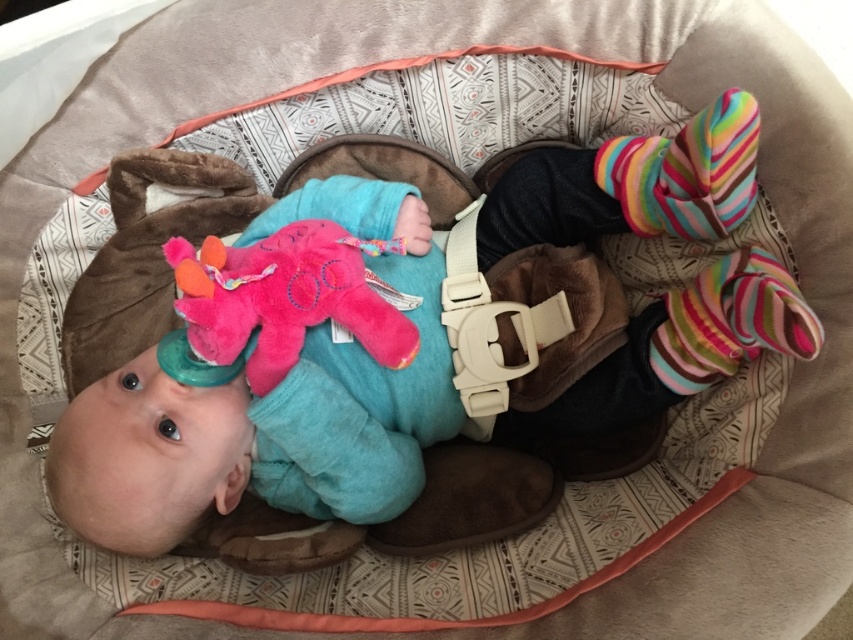
Which is more to the right, multicolored fuzzy socks at upper right or multicolored striped sock at right?

→ multicolored striped sock at right is more to the right.

Is multicolored fuzzy socks at upper right to the right of multicolored striped sock at right from the viewer's perspective?

No, multicolored fuzzy socks at upper right is not to the right of multicolored striped sock at right.

Who is more distant from viewer, (653, 180) or (786, 332)?

The point (653, 180) is more distant.

Identify the location of multicolored fuzzy socks at upper right. (686, 172).

Is pink plush toy at center below multicolored striped sock at right?

Actually, pink plush toy at center is above multicolored striped sock at right.

In the scene shown: Is pink plush toy at center bigger than multicolored striped sock at right?

Yes, pink plush toy at center is bigger than multicolored striped sock at right.

Does point (238, 252) come farther from viewer compared to point (750, 316)?

Yes, it is.

Locate an element on the screen. pink plush toy at center is located at coordinates (281, 301).

Is point (216, 310) farther from camera compared to point (695, 122)?

Yes, it is behind point (695, 122).

What do you see at coordinates (281, 301) in the screenshot? Image resolution: width=853 pixels, height=640 pixels. I see `pink plush toy at center` at bounding box center [281, 301].

Identify the location of pink plush toy at center. This screenshot has height=640, width=853. (281, 301).